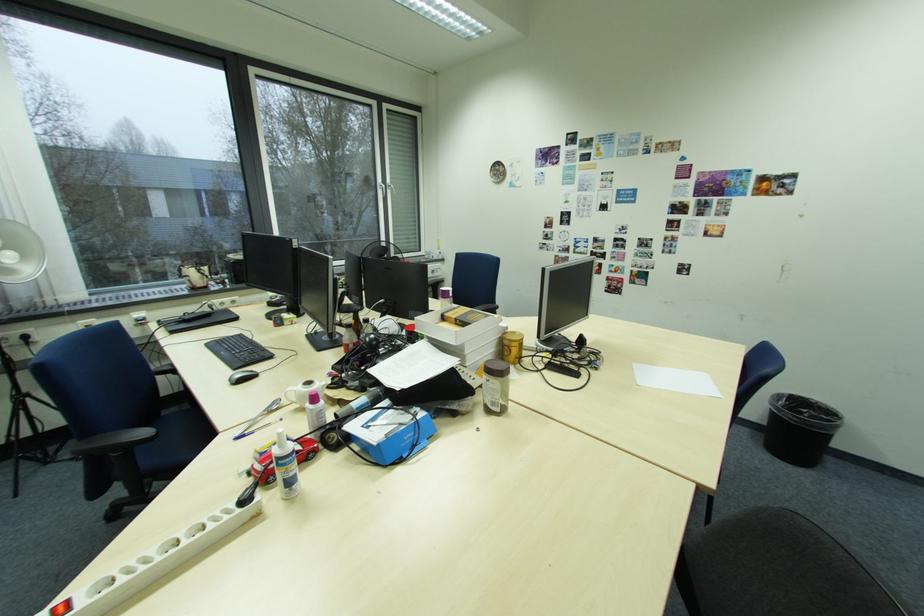
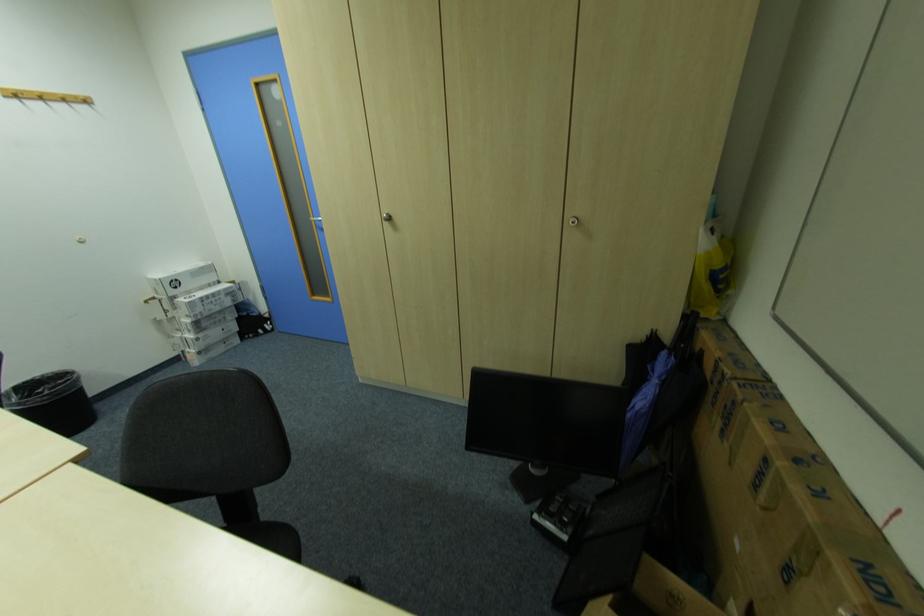
Based on the continuous images, in which direction is the camera rotating?

The camera's rotation is toward right-down.